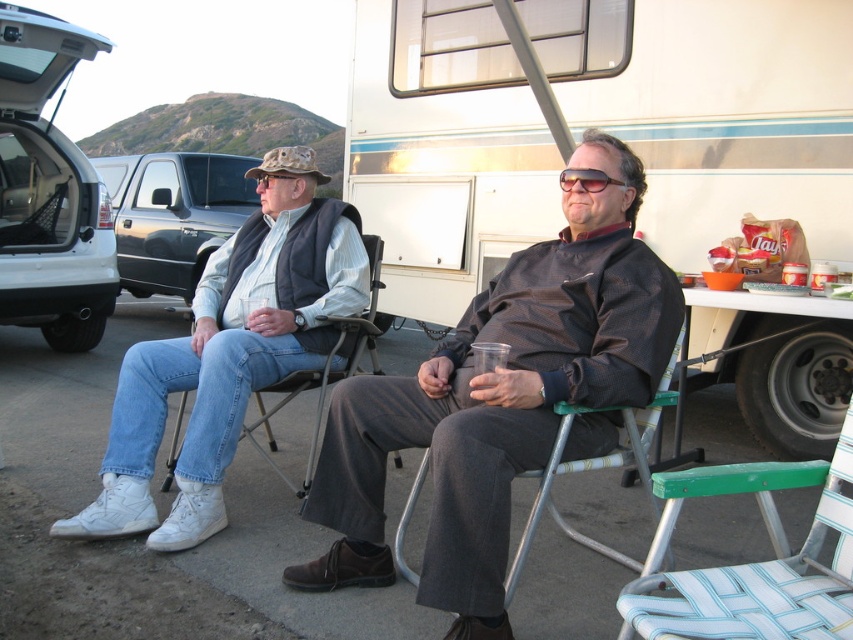
Question: Which object is farther from the camera taking this photo?

Choices:
 (A) white matte van at left
 (B) white leather shoes at lower left
 (C) denim fabric chair at left
 (D) brushed metal truck at upper left

Answer: (D)

Question: Is white leather shoes at lower left to the left of green woven fabric folding chair at lower right from the viewer's perspective?

Choices:
 (A) yes
 (B) no

Answer: (A)

Question: Does green woven fabric folding chair at lower right come in front of brushed metal truck at upper left?

Choices:
 (A) yes
 (B) no

Answer: (A)

Question: Among these objects, which one is farthest from the camera?

Choices:
 (A) dark gray fabric jacket at center
 (B) green woven fabric folding chair at lower right
 (C) denim fabric chair at left

Answer: (C)

Question: Considering the real-world distances, which object is farthest from the dark gray fabric jacket at center?

Choices:
 (A) white leather shoes at lower left
 (B) white vinyl recreational vehicle at center
 (C) white matte van at left
 (D) denim fabric chair at left

Answer: (C)

Question: From the image, what is the correct spatial relationship of white matte van at left in relation to denim fabric chair at left?

Choices:
 (A) left
 (B) right

Answer: (A)